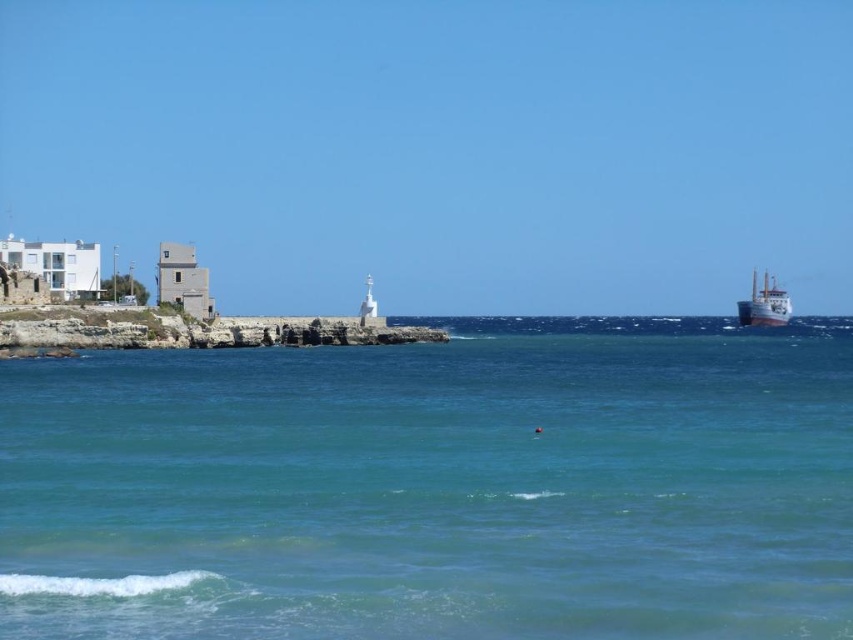
Consider the image. Does clear blue water at center have a smaller size compared to metallic gray ship at right?

No, clear blue water at center is not smaller than metallic gray ship at right.

Is clear blue water at center to the left of metallic gray ship at right from the viewer's perspective?

Indeed, clear blue water at center is positioned on the left side of metallic gray ship at right.

What do you see at coordinates (434, 486) in the screenshot?
I see `clear blue water at center` at bounding box center [434, 486].

Where is `clear blue water at center`? clear blue water at center is located at coordinates (434, 486).